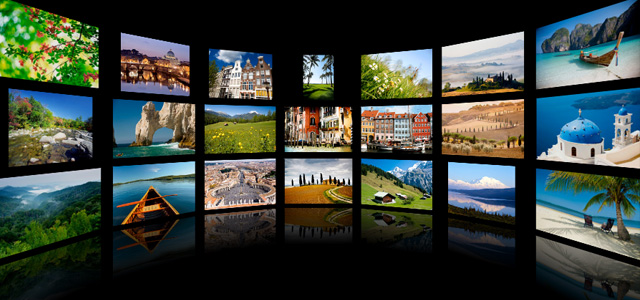
Find the location of a particular element. The height and width of the screenshot is (300, 640). middle row of tv screens is located at coordinates (58, 127), (163, 129), (243, 129), (324, 126), (392, 123), (473, 128), (589, 131).